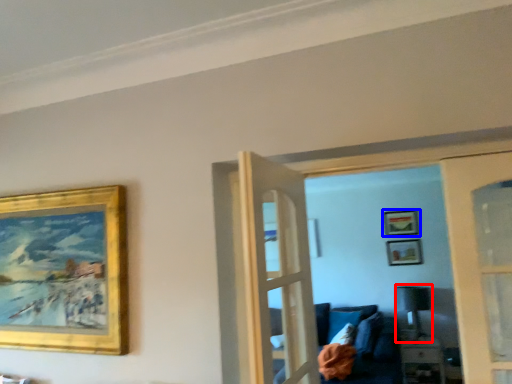
Question: Which point is further to the camera, lamp (highlighted by a red box) or picture frame (highlighted by a blue box)?

Choices:
 (A) lamp
 (B) picture frame

Answer: (B)